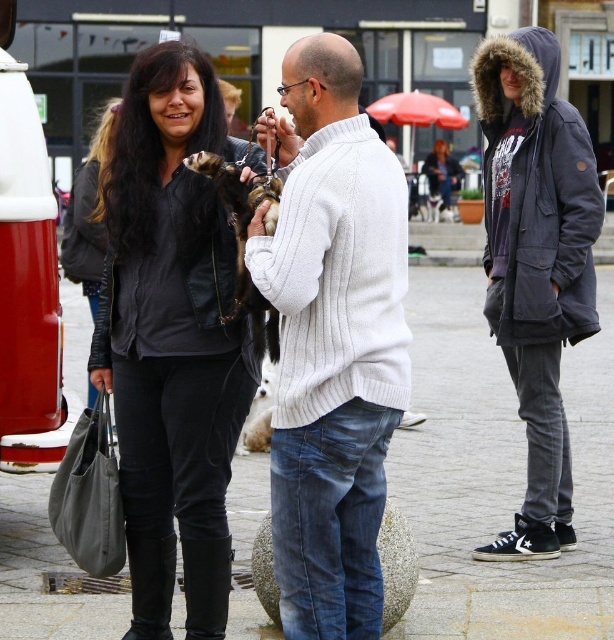
Does point (265, 483) lie behind point (195, 161)?

That is True.

Is point (421, 392) closer to viewer compared to point (271, 179)?

That is False.

Is point (426, 474) positioned after point (219, 182)?

Yes, it is behind point (219, 182).

The image size is (614, 640). In order to click on paved stone pavement at center in this screenshot , I will do `click(499, 474)`.

Describe the element at coordinates (537, 262) in the screenshot. The width and height of the screenshot is (614, 640). I see `dark blue hooded parka at right` at that location.

Is dark blue hooded parka at right shorter than furry black ferret at center?

In fact, dark blue hooded parka at right may be taller than furry black ferret at center.

Who is more forward, (578,196) or (203,170)?

Point (203,170) is in front.

This screenshot has width=614, height=640. I want to click on dark blue hooded parka at right, so click(x=537, y=262).

Is point (495, 349) in front of point (553, 216)?

No, it is behind (553, 216).

Is paved stone pavement at center wider than dark blue hooded parka at right?

Indeed, paved stone pavement at center has a greater width compared to dark blue hooded parka at right.

Between point (427, 275) and point (521, 250), which one is positioned behind?

The point (427, 275) is more distant.

The image size is (614, 640). Identify the location of paved stone pavement at center. coord(499,474).